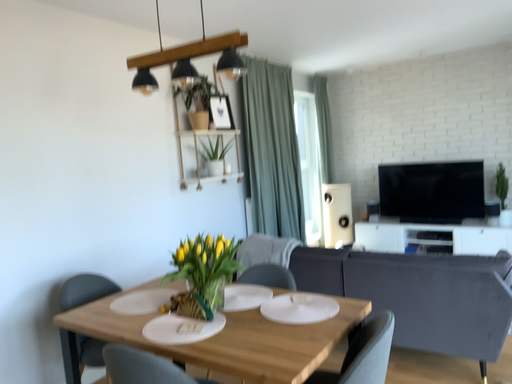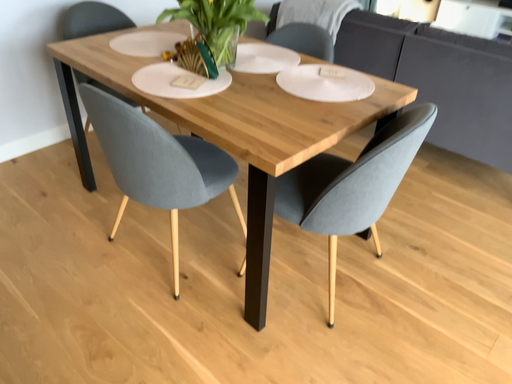
Question: How did the camera likely rotate when shooting the video?

Choices:
 (A) rotated left
 (B) rotated right

Answer: (A)